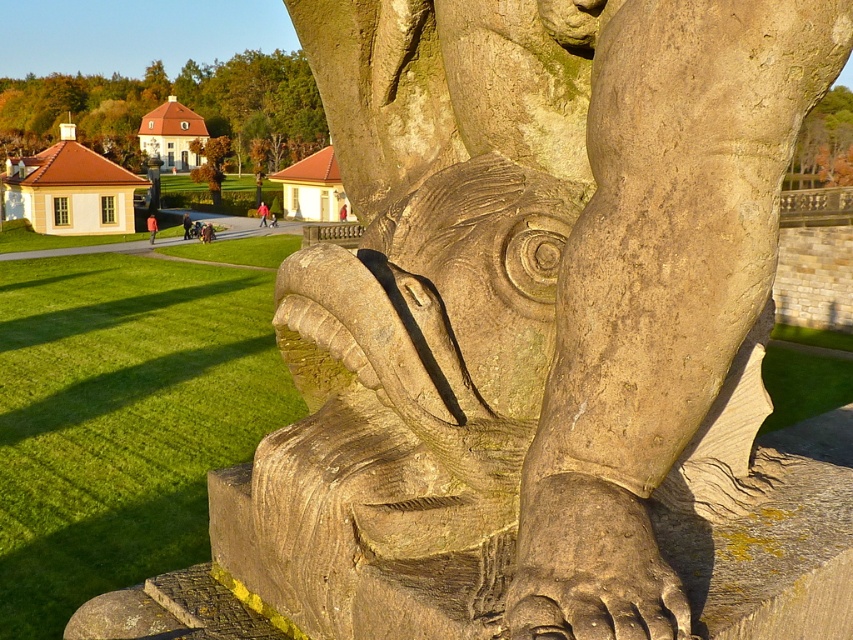
Based on the photo, can you confirm if green leafy tree at upper center is positioned below green leafy tree at center?

No, green leafy tree at upper center is not below green leafy tree at center.

What do you see at coordinates (180, 102) in the screenshot? This screenshot has height=640, width=853. I see `green leafy tree at upper center` at bounding box center [180, 102].

Between point (3, 148) and point (194, 144), which one is positioned in front?

Point (3, 148) is in front.

At what (x,y) coordinates should I click in order to perform the action: click on green leafy tree at upper center. Please return your answer as a coordinate pair (x, y). The height and width of the screenshot is (640, 853). Looking at the image, I should click on (180, 102).

Is point (795, 173) behind point (224, 134)?

Yes, it is.

Does brown rough bark at upper right appear over green leafy tree at center?

Incorrect, brown rough bark at upper right is not positioned above green leafy tree at center.

Between point (824, 184) and point (190, 177), which one is positioned behind?

The point (824, 184) is more distant.

At what (x,y) coordinates should I click in order to perform the action: click on brown rough bark at upper right. Please return your answer as a coordinate pair (x, y). The width and height of the screenshot is (853, 640). Looking at the image, I should click on (824, 145).

Between green leafy tree at upper center and brown rough bark at upper right, which one is positioned higher?

green leafy tree at upper center is higher up.

Can you confirm if green leafy tree at upper center is positioned to the left of brown rough bark at upper right?

Indeed, green leafy tree at upper center is positioned on the left side of brown rough bark at upper right.

Which is in front, point (97, 77) or point (838, 116)?

Point (97, 77) is in front.

Locate an element on the screen. The height and width of the screenshot is (640, 853). green leafy tree at upper center is located at coordinates (180, 102).